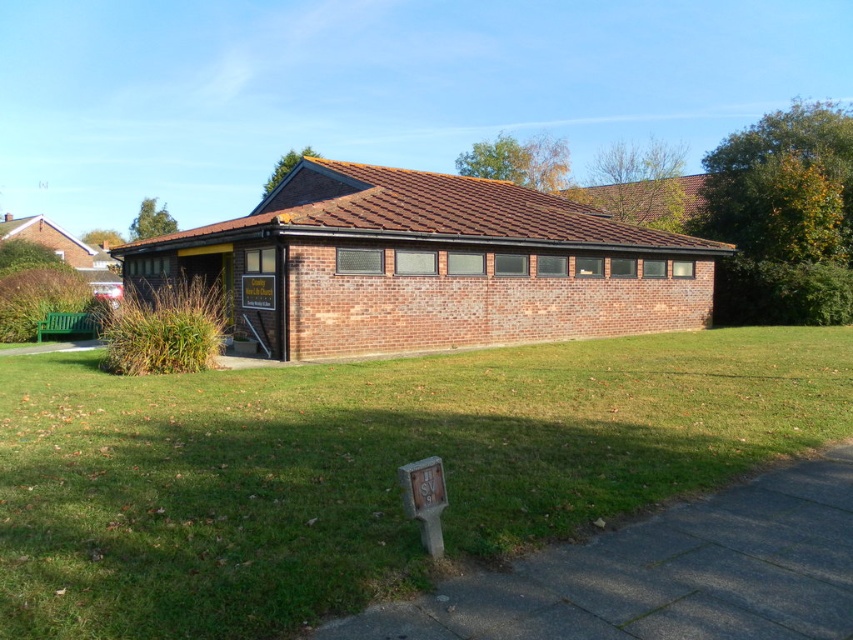
Does point (26, 547) come behind point (651, 252)?

No, it is not.

Can you confirm if green grass at center is bigger than brick building at center?

No, green grass at center is not bigger than brick building at center.

Locate an element on the screen. This screenshot has width=853, height=640. green grass at center is located at coordinates (364, 468).